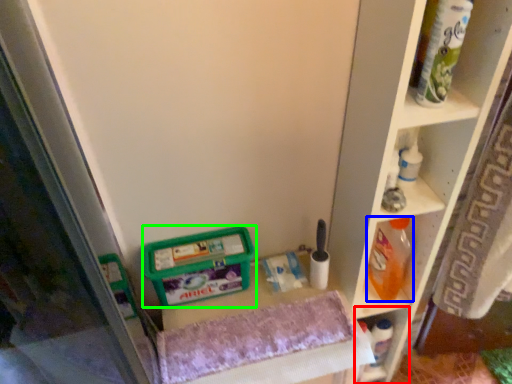
Question: Based on their relative distances, which object is farther from shelf (highlighted by a red box)? Choose from cleaning product (highlighted by a blue box) and wide (highlighted by a green box).

Choices:
 (A) cleaning product
 (B) wide

Answer: (B)